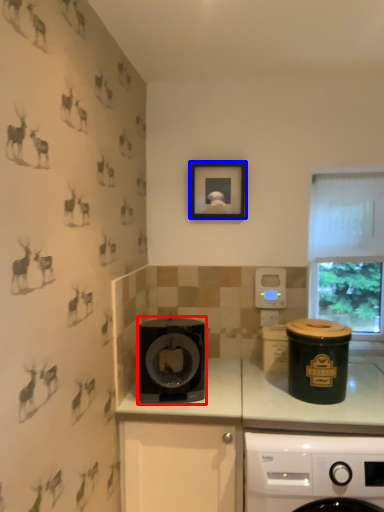
Question: Which of the following is the closest to the observer, kitchen appliance (highlighted by a red box) or picture frame (highlighted by a blue box)?

Choices:
 (A) kitchen appliance
 (B) picture frame

Answer: (A)